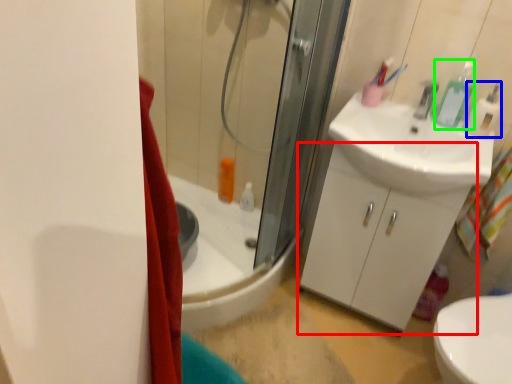
Question: Which object is positioned closest to bathroom cabinet (highlighted by a red box)? Select from soap dispenser (highlighted by a blue box) and toiletry (highlighted by a green box).

Choices:
 (A) soap dispenser
 (B) toiletry

Answer: (B)